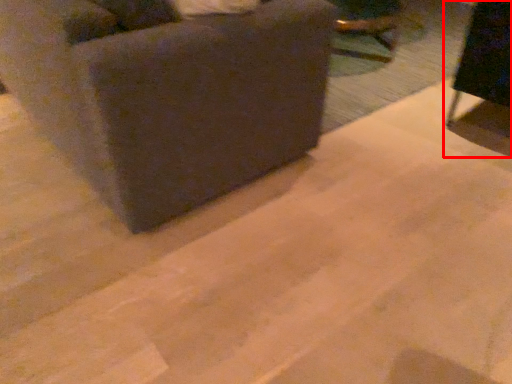
Question: From the image's perspective, considering the relative positions of furniture (annotated by the red box) and furniture in the image provided, where is furniture (annotated by the red box) located with respect to the staircase?

Choices:
 (A) above
 (B) below

Answer: (B)